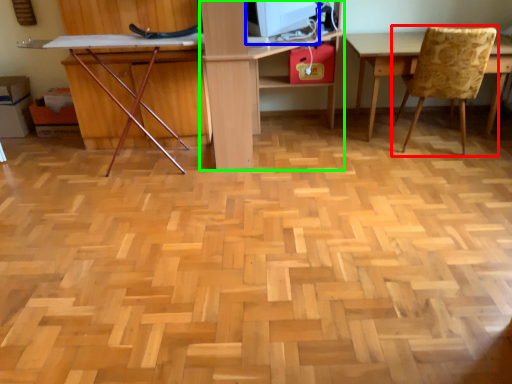
Question: Which object is the farthest from chair (highlighted by a red box)? Choose among these: computer monitor (highlighted by a blue box) or computer desk (highlighted by a green box).

Choices:
 (A) computer monitor
 (B) computer desk

Answer: (B)